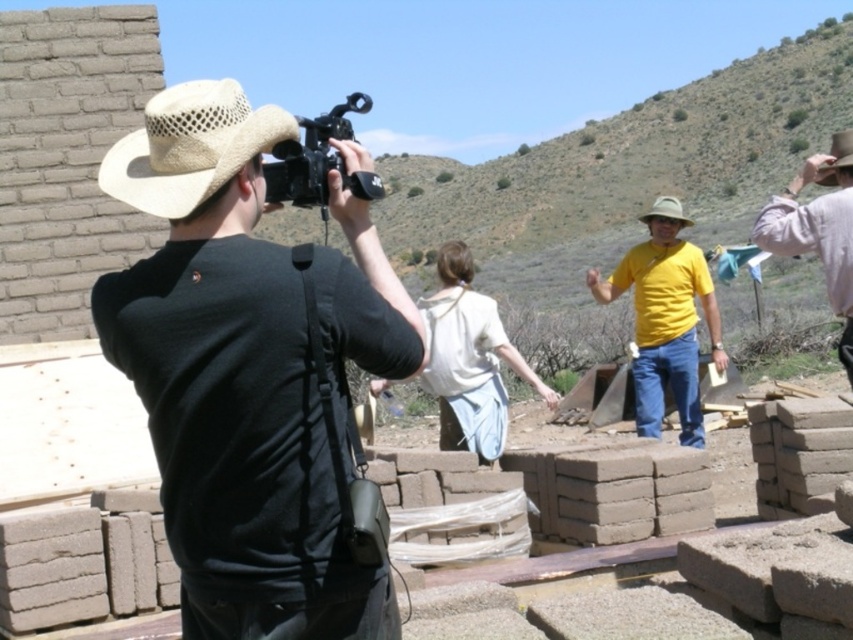
Question: Does light brown leather hat at right have a smaller size compared to light brown straw cowboy hat at center?

Choices:
 (A) no
 (B) yes

Answer: (B)

Question: Is beige straw hat at upper left wider than matte black camera at upper center?

Choices:
 (A) no
 (B) yes

Answer: (A)

Question: Which object is the farthest from the light brown leather hat at right?

Choices:
 (A) matte black camera at upper center
 (B) matte straw hat at center

Answer: (A)

Question: Which point is closer to the camera?

Choices:
 (A) beige straw hat at upper left
 (B) light brown leather hat at right
 (C) matte black camera at upper center

Answer: (A)

Question: Which point is farther to the camera?

Choices:
 (A) matte black camera at upper center
 (B) beige straw hat at upper left

Answer: (A)

Question: Can you confirm if matte straw hat at center is wider than light brown leather hat at right?

Choices:
 (A) no
 (B) yes

Answer: (A)